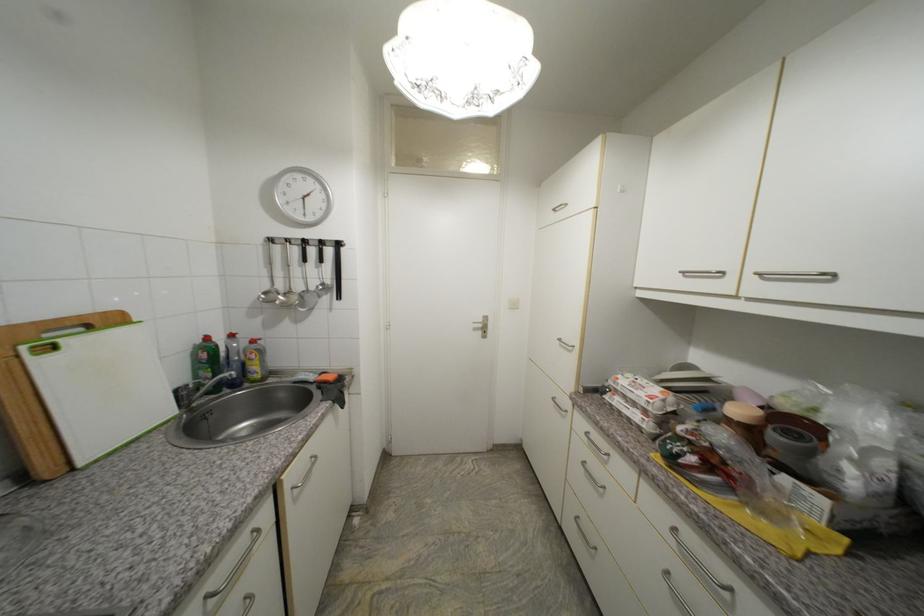
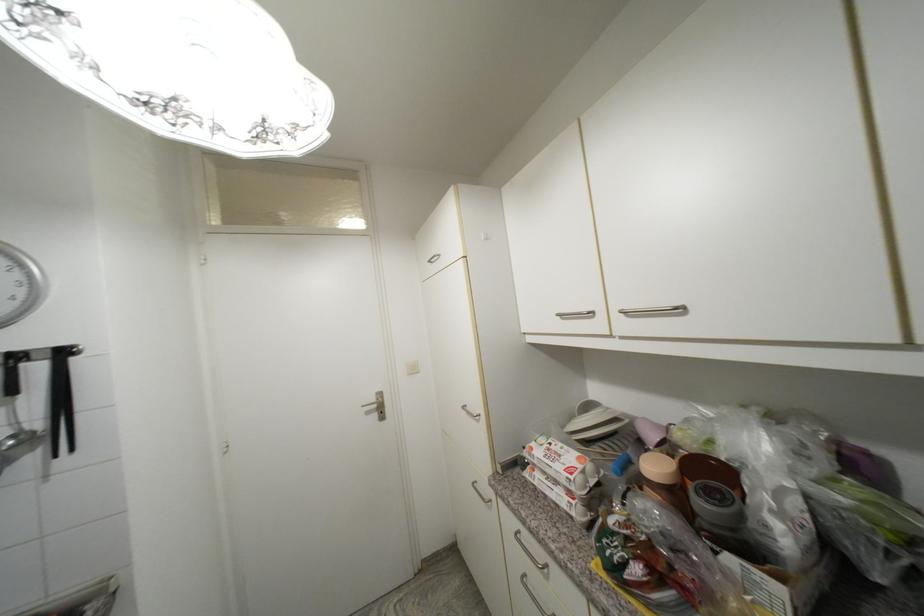
Find the pixel in the second image that matches point (623, 379) in the first image.

(537, 451)